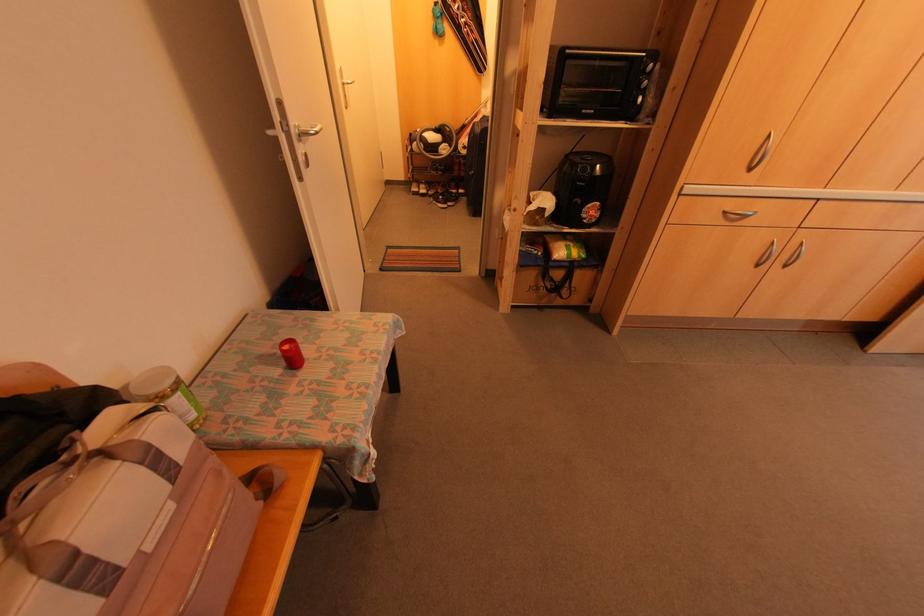
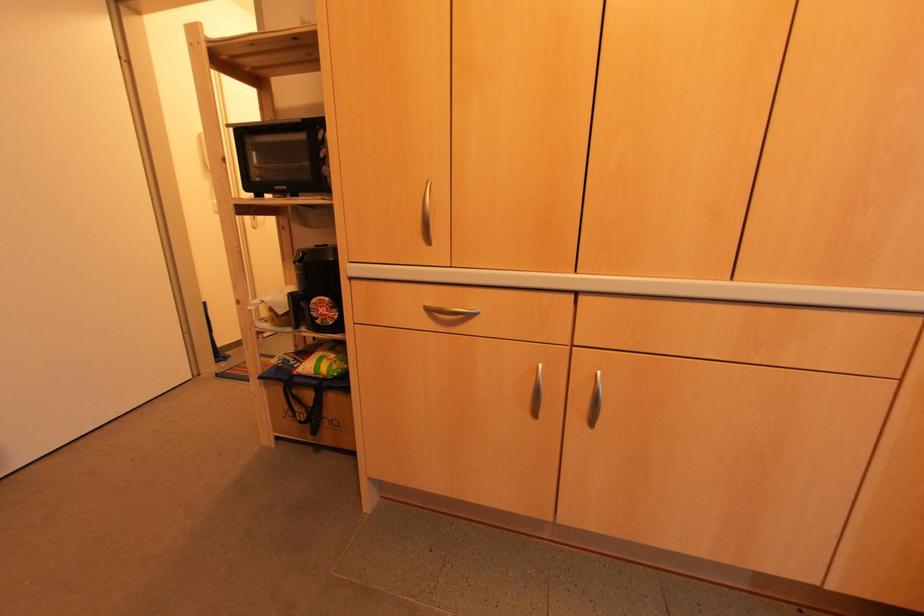
The images are taken continuously from a first-person perspective. In which direction are you moving?

The movement direction of the cameraman is right, forward.